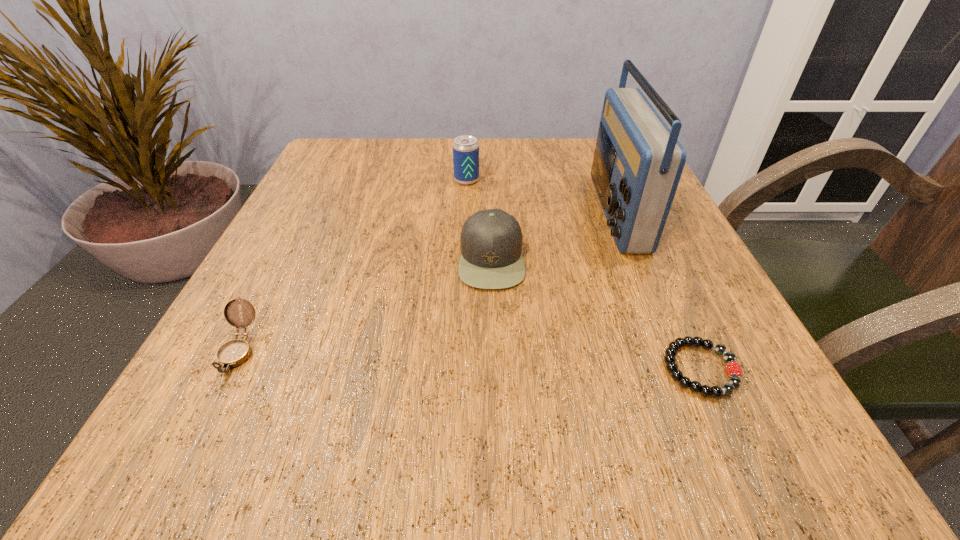
I want to click on object that is positioned at the far right corner, so click(x=638, y=161).

This screenshot has height=540, width=960. Find the location of `vacant area at the far edge of the desktop`. vacant area at the far edge of the desktop is located at coordinates (491, 139).

You are a GUI agent. You are given a task and a screenshot of the screen. Output one action in this format:
    pyautogui.click(x=<x>, y=<y>)
    Task: Click on the vacant region at the near edge of the desktop
    Image resolution: width=960 pixels, height=540 pixels.
    Given the screenshot: What is the action you would take?
    pyautogui.click(x=395, y=458)

At what (x,y) coordinates should I click in order to perform the action: click on vacant region at the left edge of the desktop. Please return your answer as a coordinate pair (x, y). The width and height of the screenshot is (960, 540). Looking at the image, I should click on (271, 236).

Locate an element on the screen. vacant region at the right edge of the desktop is located at coordinates (599, 212).

Where is `free space at the far left corner of the desktop`? The height and width of the screenshot is (540, 960). free space at the far left corner of the desktop is located at coordinates (377, 180).

Where is `vacant area that lies between the third shortest object and the shortest object`? The height and width of the screenshot is (540, 960). vacant area that lies between the third shortest object and the shortest object is located at coordinates (596, 314).

Locate an element on the screen. This screenshot has width=960, height=540. vacant space that's between the fourth tallest object and the beer can is located at coordinates pyautogui.click(x=352, y=266).

This screenshot has height=540, width=960. I want to click on free point between the shortest object and the beer can, so click(584, 275).

Locate an element on the screen. Image resolution: width=960 pixels, height=540 pixels. vacant region between the second shortest object and the shortest object is located at coordinates (469, 360).